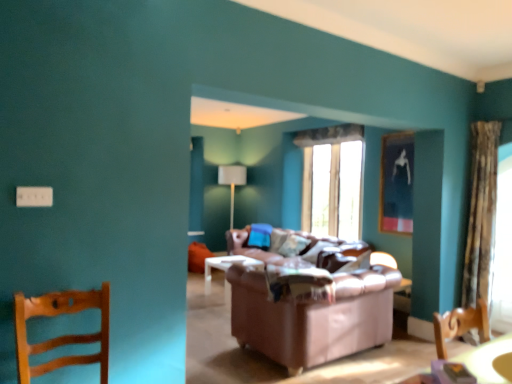
Question: Is transparent fabric at right facing towards metallic silver picture frame at upper right?

Choices:
 (A) yes
 (B) no

Answer: (B)

Question: From the image's perspective, is transparent fabric at right located above metallic silver picture frame at upper right?

Choices:
 (A) no
 (B) yes

Answer: (A)

Question: Does transparent fabric at right appear on the left side of metallic silver picture frame at upper right?

Choices:
 (A) no
 (B) yes

Answer: (A)

Question: Is transparent fabric at right shorter than metallic silver picture frame at upper right?

Choices:
 (A) yes
 (B) no

Answer: (B)

Question: Is transparent fabric at right far from metallic silver picture frame at upper right?

Choices:
 (A) yes
 (B) no

Answer: (A)

Question: From the image's perspective, is transparent glass window at center above or below patterned fabric curtain at right?

Choices:
 (A) below
 (B) above

Answer: (B)

Question: In terms of size, does transparent glass window at center appear bigger or smaller than patterned fabric curtain at right?

Choices:
 (A) small
 (B) big

Answer: (B)

Question: From a real-world perspective, relative to patterned fabric curtain at right, is transparent glass window at center vertically above or below?

Choices:
 (A) above
 (B) below

Answer: (A)

Question: Do you think transparent glass window at center is within patterned fabric curtain at right, or outside of it?

Choices:
 (A) outside
 (B) inside

Answer: (A)

Question: Is transparent glass window at center bigger or smaller than brown leather couch at center?

Choices:
 (A) small
 (B) big

Answer: (A)

Question: From a real-world perspective, is transparent glass window at center positioned above or below brown leather couch at center?

Choices:
 (A) below
 (B) above

Answer: (B)

Question: From the image's perspective, is transparent glass window at center above or below brown leather couch at center?

Choices:
 (A) above
 (B) below

Answer: (A)

Question: Is point (358, 170) positioned closer to the camera than point (360, 345)?

Choices:
 (A) farther
 (B) closer

Answer: (A)

Question: Relative to metallic silver picture frame at upper right, is wooden chair at left in front or behind?

Choices:
 (A) front
 (B) behind

Answer: (A)

Question: Is wooden chair at left taller or shorter than metallic silver picture frame at upper right?

Choices:
 (A) short
 (B) tall

Answer: (A)